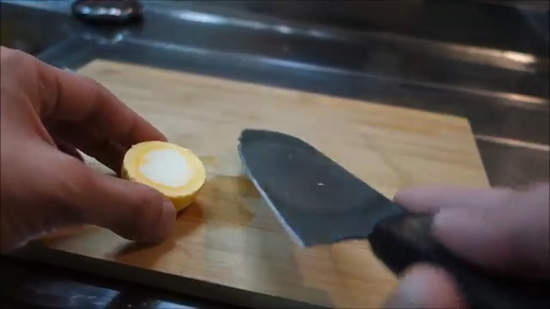
This screenshot has height=309, width=550. What are the coordinates of `striations in wood on cutting board` in the screenshot? It's located at (177, 103), (261, 258), (192, 266), (179, 250).